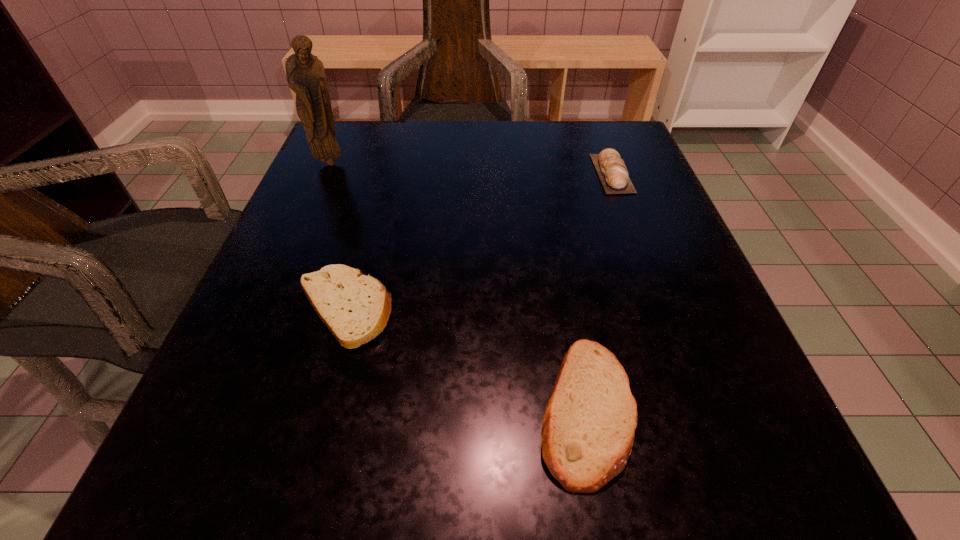
Image resolution: width=960 pixels, height=540 pixels. I want to click on free space at the left edge, so click(330, 241).

Find the location of a particular element. The width and height of the screenshot is (960, 540). vacant space at the right edge of the desktop is located at coordinates (638, 338).

The image size is (960, 540). In order to click on blank space at the far left corner of the desktop in this screenshot , I will do `click(384, 146)`.

In the image, there is a desktop. What are the coordinates of `vacant space at the far right corner` in the screenshot? It's located at (613, 148).

You are a GUI agent. You are given a task and a screenshot of the screen. Output one action in this format:
    pyautogui.click(x=<x>, y=<y>)
    Task: Click on the vacant point located between the rightmost object and the tallest object
    The image size is (960, 540).
    Given the screenshot: What is the action you would take?
    pyautogui.click(x=471, y=168)

Locate an element on the screen. free space between the farthest pita bread and the third object from right to left is located at coordinates (478, 241).

The image size is (960, 540). In order to click on vacant point located between the figurine and the rightmost pita bread in this screenshot , I will do `click(471, 168)`.

Locate an element on the screen. This screenshot has width=960, height=540. free space between the second pita bread from right to left and the rightmost pita bread is located at coordinates (599, 291).

Find the location of a particular element. vacant space in between the shortest pita bread and the farthest pita bread is located at coordinates (478, 241).

Find the location of a particular element. The height and width of the screenshot is (540, 960). blank region between the third object from left to right and the third object from right to left is located at coordinates (465, 359).